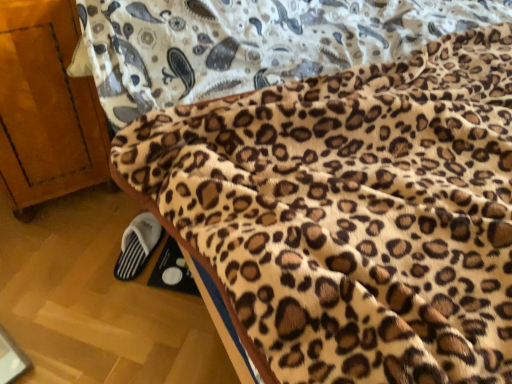
This screenshot has width=512, height=384. Find the location of `vacant space in front of wooden cabinet at left`. vacant space in front of wooden cabinet at left is located at coordinates (60, 271).